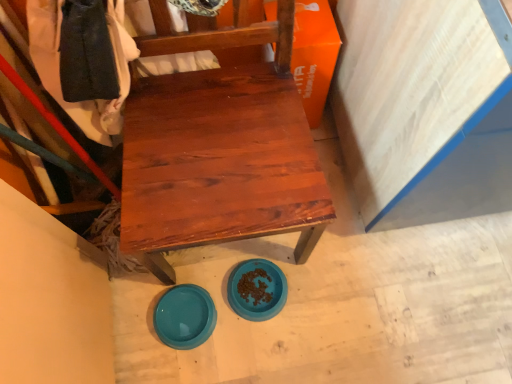
This screenshot has height=384, width=512. I want to click on vacant area that lies between teal glossy plate at lower center, arranged as the 1th plate when viewed from the left, and blue plastic bowl at lower center, marked as the 2th plate in a left-to-right arrangement, so click(x=224, y=306).